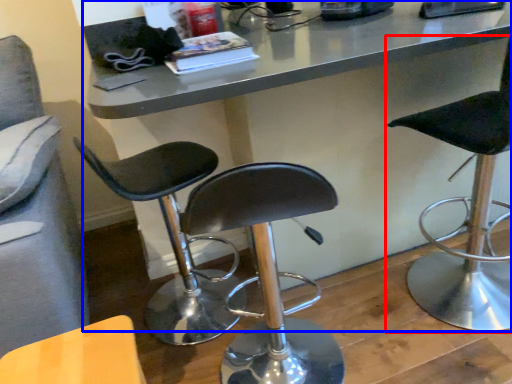
Question: Which object is closer to the camera taking this photo, chair (highlighted by a red box) or table (highlighted by a blue box)?

Choices:
 (A) chair
 (B) table

Answer: (A)